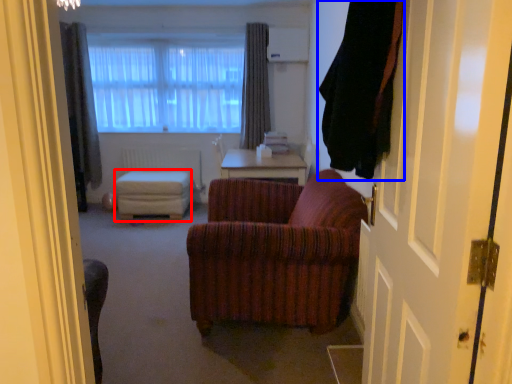
Question: Among these objects, which one is farthest to the camera, stool (highlighted by a red box) or curtain (highlighted by a blue box)?

Choices:
 (A) stool
 (B) curtain

Answer: (A)